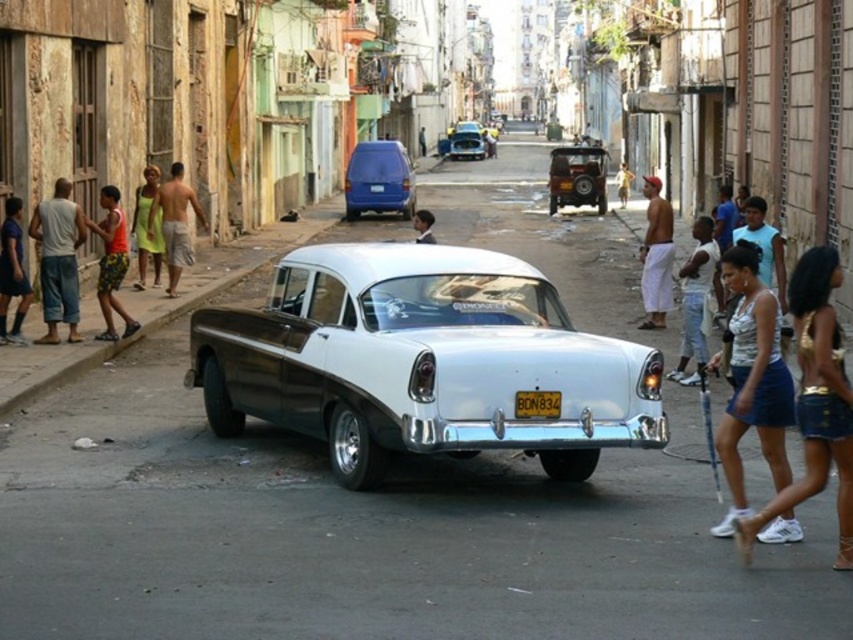
Is white cotton shorts at right thinner than smooth skin man at center?

No.

Who is more forward, (648, 273) or (624, 205)?

Positioned in front is point (648, 273).

Who is more forward, (x=648, y=224) or (x=618, y=173)?

Point (x=648, y=224) is more forward.

You are a GUI agent. You are given a task and a screenshot of the screen. Output one action in this format:
    pyautogui.click(x=<x>, y=<y>)
    Task: Click on the white cotton shorts at right
    Image resolution: width=853 pixels, height=640 pixels.
    Given the screenshot: What is the action you would take?
    pyautogui.click(x=656, y=257)

Is point (148, 218) positioned after point (618, 179)?

No, it is not.

Does tan skin shirtless man at left lie in front of smooth skin man at center?

Yes, it is.

Is point (177, 243) more distant than point (624, 170)?

That is False.

I want to click on tan skin shirtless man at left, so click(175, 221).

Between white glossy car at center and light skin tone shorts at right, which one is positioned lower?

white glossy car at center is below.

What are the coordinates of `white glossy car at center` in the screenshot? It's located at (421, 362).

Identify the location of white glossy car at center. The height and width of the screenshot is (640, 853). (x=421, y=362).